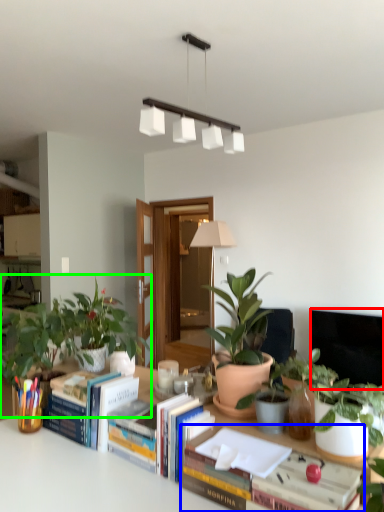
Question: Considering the real-world distances, which object is farthest from television (highlighted by a red box)? book (highlighted by a blue box) or houseplant (highlighted by a green box)?

Choices:
 (A) book
 (B) houseplant

Answer: (A)